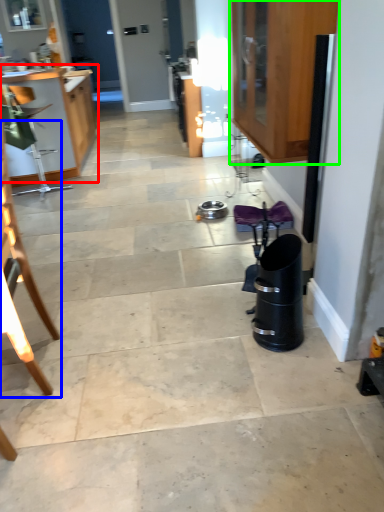
Question: Which is nearer to the cabinetry (highlighted by a red box)? chair (highlighted by a blue box) or cabinetry (highlighted by a green box).

Choices:
 (A) chair
 (B) cabinetry

Answer: (B)